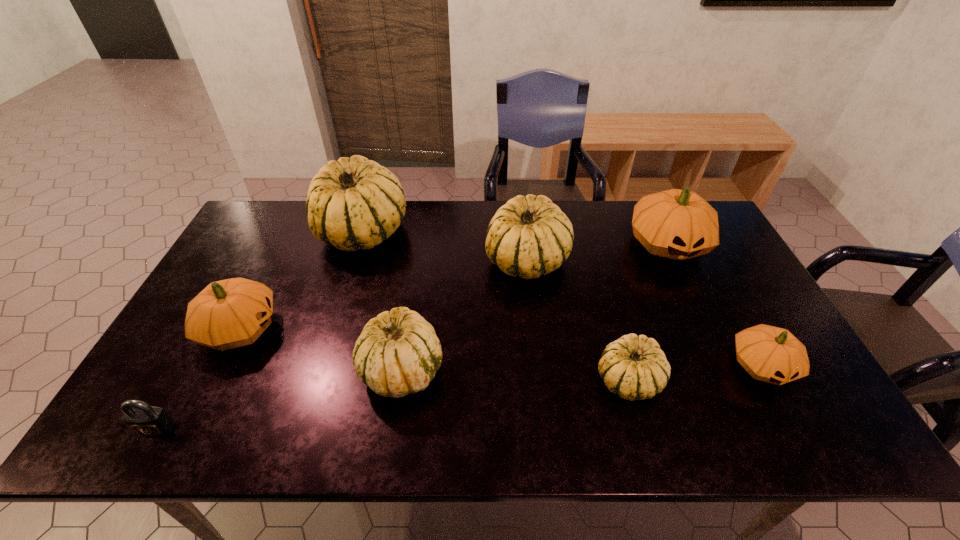
This screenshot has width=960, height=540. I want to click on the biggest white gourd, so click(x=354, y=203).

The width and height of the screenshot is (960, 540). Find the location of `the farthest orange gourd`. the farthest orange gourd is located at coordinates (678, 224).

Locate an element on the screen. Image resolution: width=960 pixels, height=540 pixels. the third white gourd from left to right is located at coordinates (530, 236).

Identify the location of the fourth gourd from left to right. The height and width of the screenshot is (540, 960). (530, 236).

I want to click on the second biggest orange gourd, so click(230, 313).

Identify the location of the third biggest white gourd. The image size is (960, 540). (398, 353).

At what (x,y) coordinates should I click in order to perform the action: click on the smallest orange gourd. Please return your answer as a coordinate pair (x, y). Looking at the image, I should click on (770, 354).

Find the location of a particular element. the fifth gourd from left to right is located at coordinates (634, 367).

At what (x,y) coordinates should I click in order to perform the action: click on the smallest white gourd. Please return your answer as a coordinate pair (x, y). This screenshot has width=960, height=540. Looking at the image, I should click on (634, 367).

Image resolution: width=960 pixels, height=540 pixels. What are the coordinates of `gray padlock` in the screenshot? It's located at (140, 417).